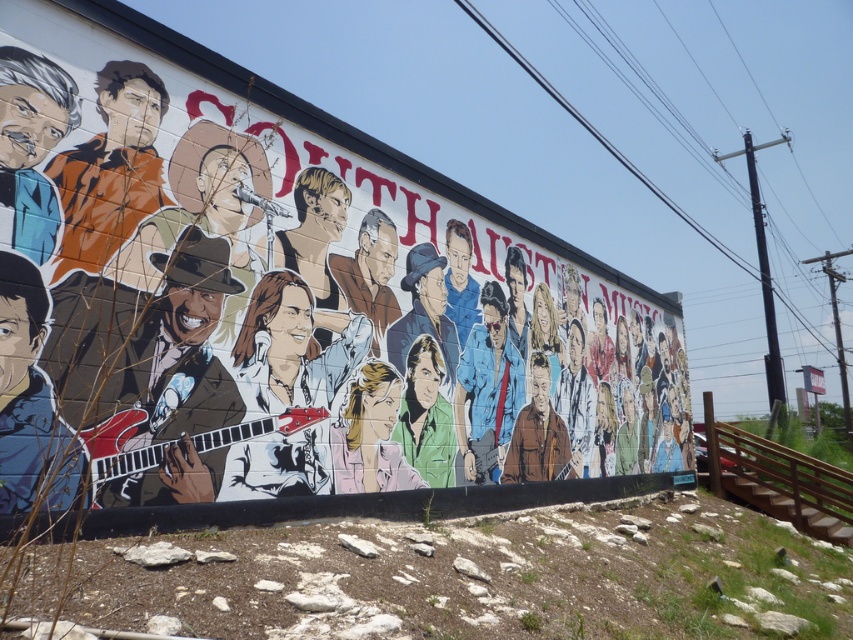
You are standing in front of the mural and want to touch the matte brown jacket at left and the matte black suit at upper left. Which one would you need to reach forward more to touch?

You would need to reach forward more to touch the matte brown jacket at left because it is in front of the matte black suit at upper left, meaning it is closer to you.

You are an art student analyzing the mural. You notice a point at coordinates (291,348). What object is located at that specific point?

The white glossy guitar at center is located at point (291,348).

You are an art student analyzing the mural. You notice the matte brown jacket at left and the matte black suit at upper left. Which one is positioned higher up on the mural?

The matte black suit at upper left is positioned higher up on the mural than the matte brown jacket at left.